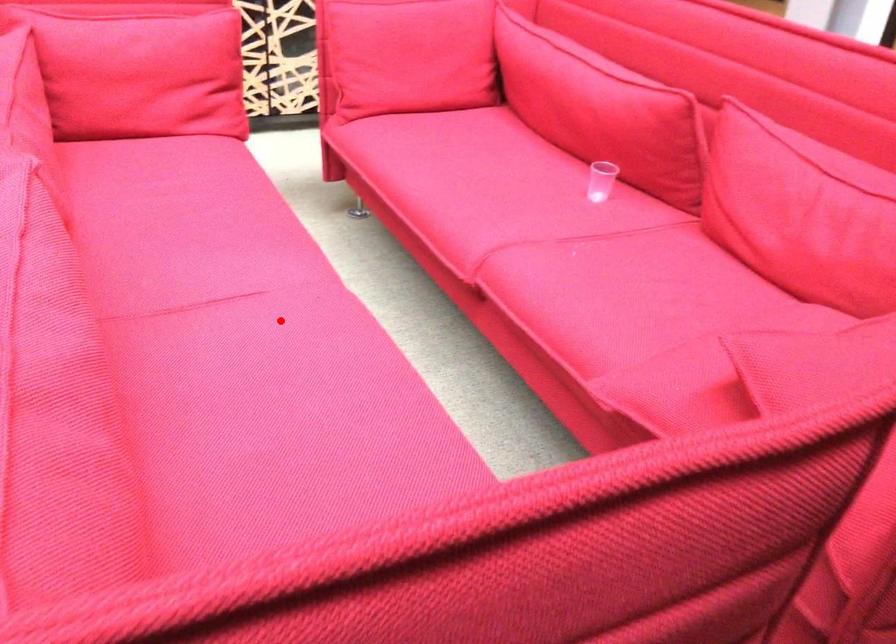
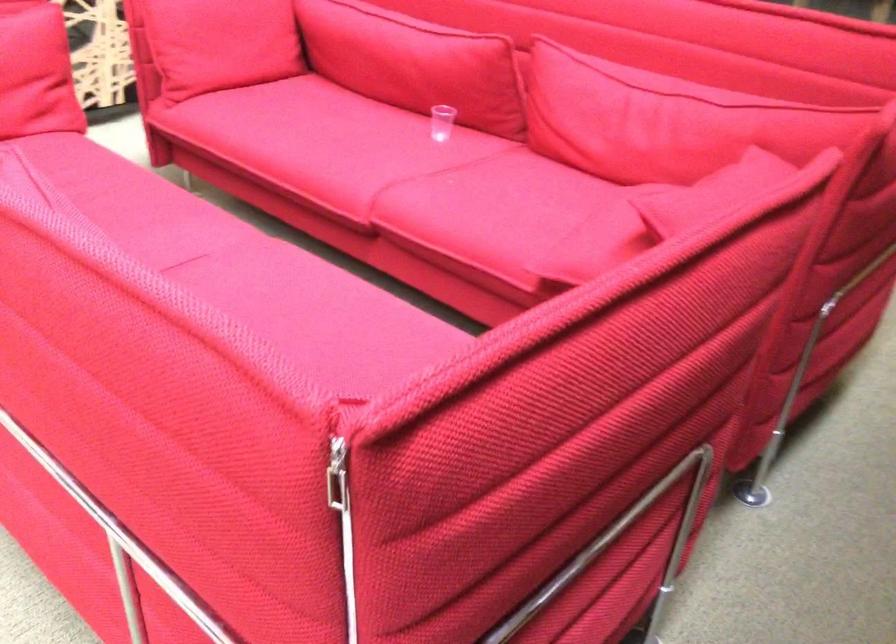
Question: I am providing you with two images of the same scene from different viewpoints. A red point is marked on the first image. Can you still see the location of the red point in image 2?

Choices:
 (A) Yes
 (B) No

Answer: (A)